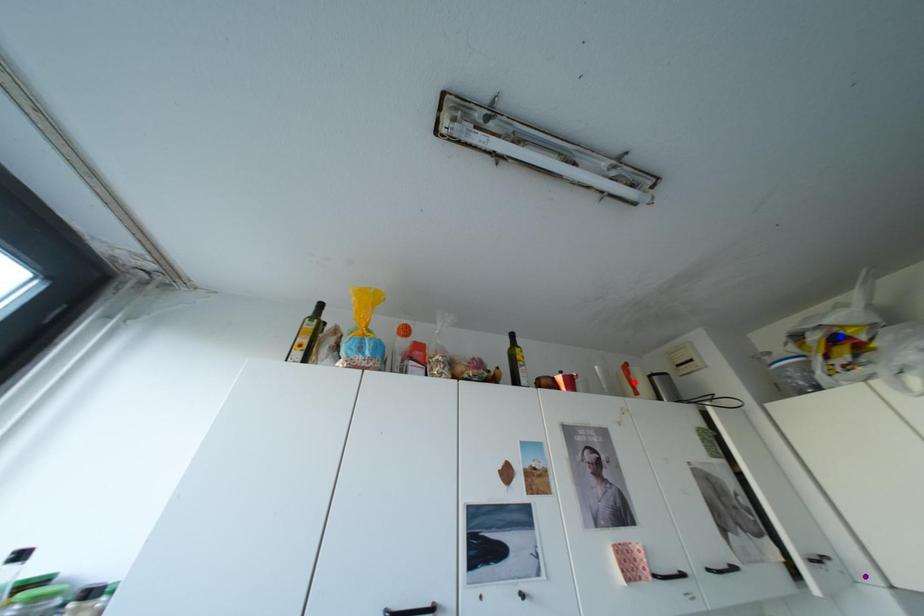
Consider the image. Order these from nearest to farthest:
A) purple point
B) blue point
C) red point

red point
blue point
purple point